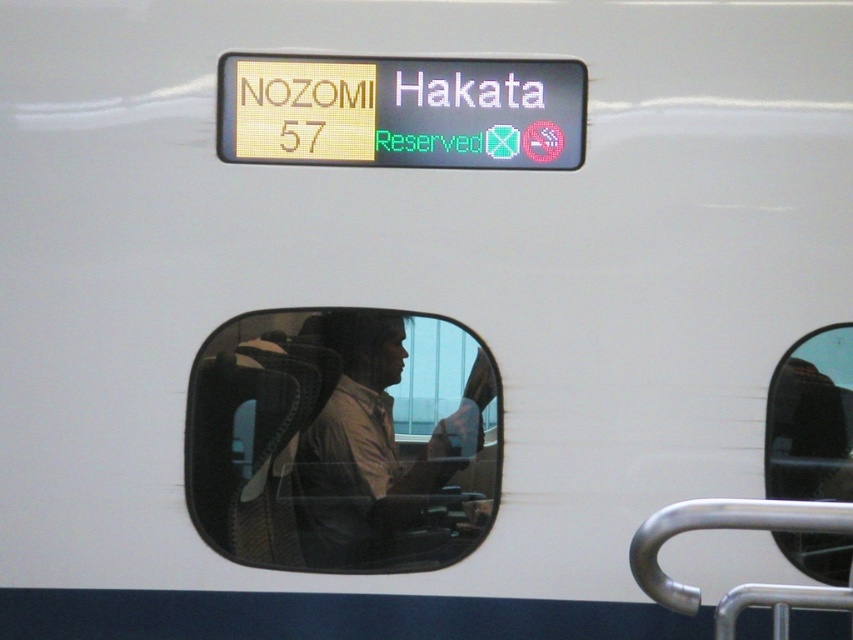
Who is more distant from viewer, (302, 552) or (851, 474)?

Point (302, 552)

Is point (195, 483) in front of point (819, 541)?

No, (195, 483) is further to viewer.

Where is `transparent glass train window at center`? Image resolution: width=853 pixels, height=640 pixels. transparent glass train window at center is located at coordinates (341, 440).

Which is more to the right, yellow plastic sign at upper center or transparent glass window at lower right?

transparent glass window at lower right is more to the right.

Who is more forward, (503, 157) or (821, 540)?

Positioned in front is point (503, 157).

Locate an element on the screen. This screenshot has width=853, height=640. yellow plastic sign at upper center is located at coordinates (401, 112).

In the scene shown: Measure the distance between point (317, 483) and camera.

3.77 meters

Which of these two, transparent glass train window at center or silver metallic handrail at lower right, stands shorter?

With less height is silver metallic handrail at lower right.

Identify the location of transparent glass train window at center. The width and height of the screenshot is (853, 640). (341, 440).